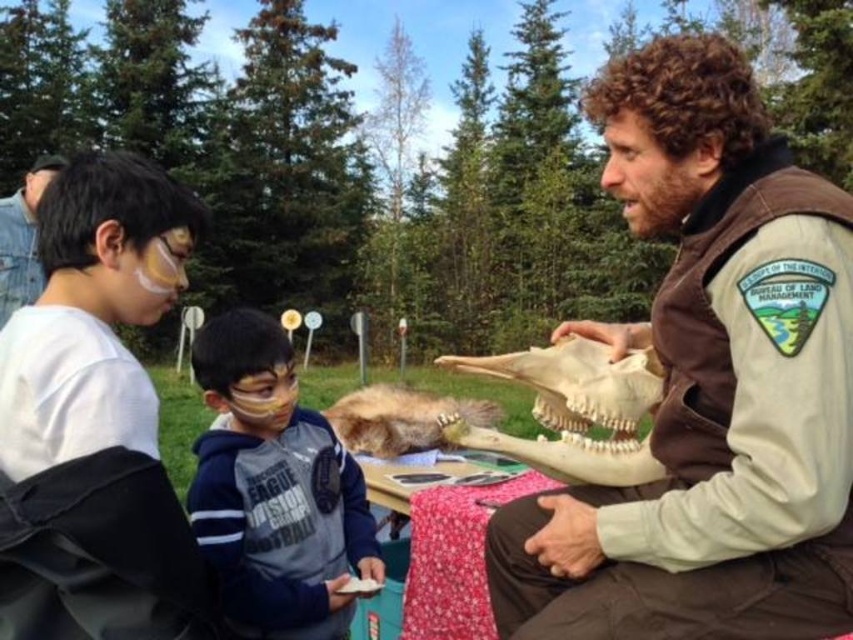
Question: Which point is closer to the camera?

Choices:
 (A) (674, 497)
 (B) (341, 464)
 (C) (642, 481)

Answer: (A)

Question: Which object appears closest to the camera in this image?

Choices:
 (A) brown suede vest at center
 (B) denim jacket at upper left
 (C) gray fleece sweatshirt at center

Answer: (A)

Question: Is brown suede vest at center smaller than gray fleece sweatshirt at center?

Choices:
 (A) yes
 (B) no

Answer: (B)

Question: Does brown suede vest at center appear over denim jacket at upper left?

Choices:
 (A) yes
 (B) no

Answer: (B)

Question: Is brown suede vest at center in front of white bone skull at center?

Choices:
 (A) yes
 (B) no

Answer: (A)

Question: Which point is farther to the camera?

Choices:
 (A) (376, 547)
 (B) (13, 220)

Answer: (B)